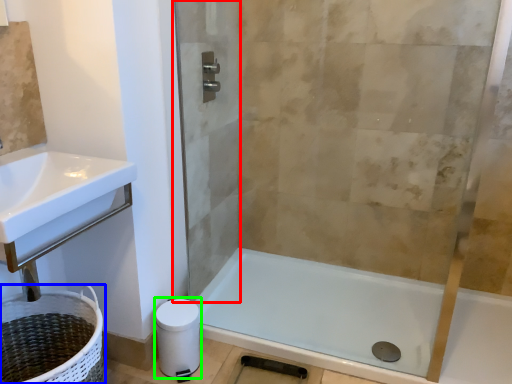
Question: Based on their relative distances, which object is farther from screen door (highlighted by a red box)? Choose from laundry basket (highlighted by a blue box) and toilet paper (highlighted by a green box).

Choices:
 (A) laundry basket
 (B) toilet paper

Answer: (A)